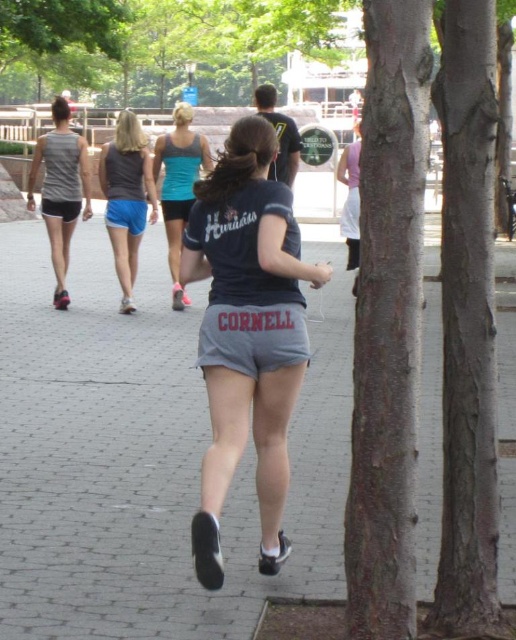
You are a photographer standing at the pathway entrance. You want to take a photo focusing on the matte gray shorts at center and the matte gray tank top at left. Which object will appear larger in the photo?

The matte gray shorts at center will appear larger in the photo because it is closer to the viewer than the matte gray tank top at left.

You are standing on the pathway and see the gray concrete pavement at center and the gray matte shorts at center. Which object is located to the right of the other?

The gray concrete pavement at center is to the right of the gray matte shorts at center.

You are standing on the gray concrete pavement at center and looking towards the gray matte shorts at center. Which object is closer to you?

The gray concrete pavement at center is closer to you because the gray matte shorts at center is behind it.